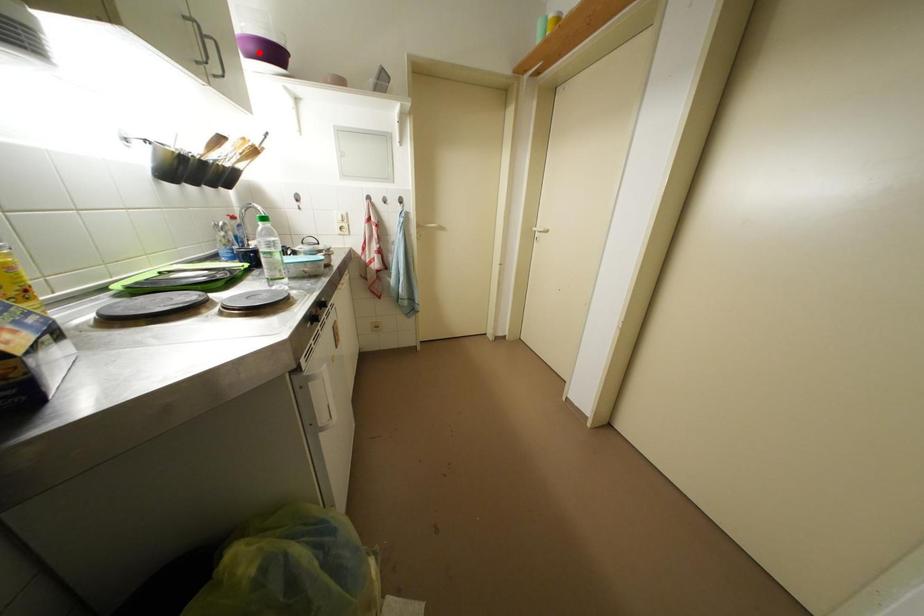
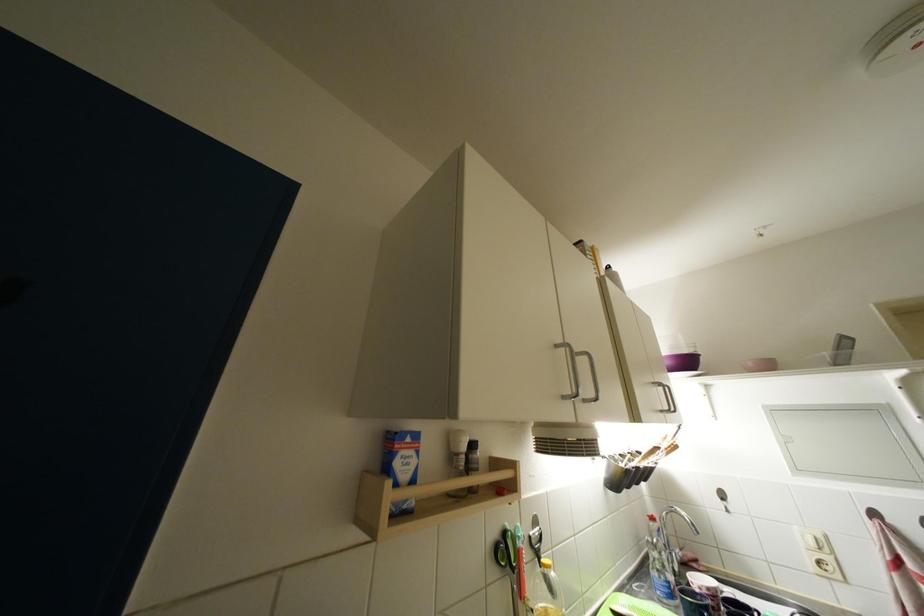
Locate, in the second image, the point that corresponds to the highlighted location in the first image.

(675, 367)